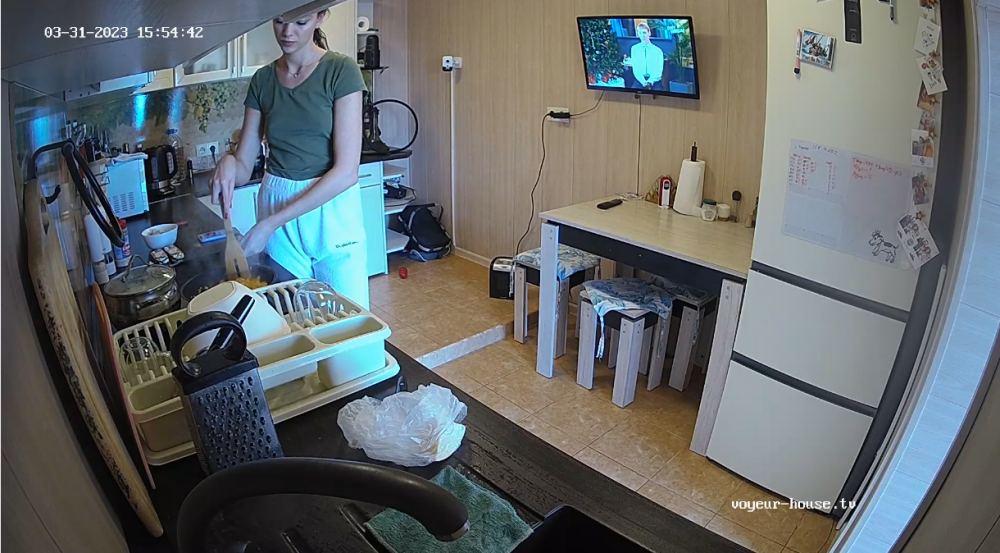
The image size is (1000, 553). In order to click on stool cushion in this screenshot , I will do pyautogui.click(x=616, y=289), pyautogui.click(x=570, y=268).